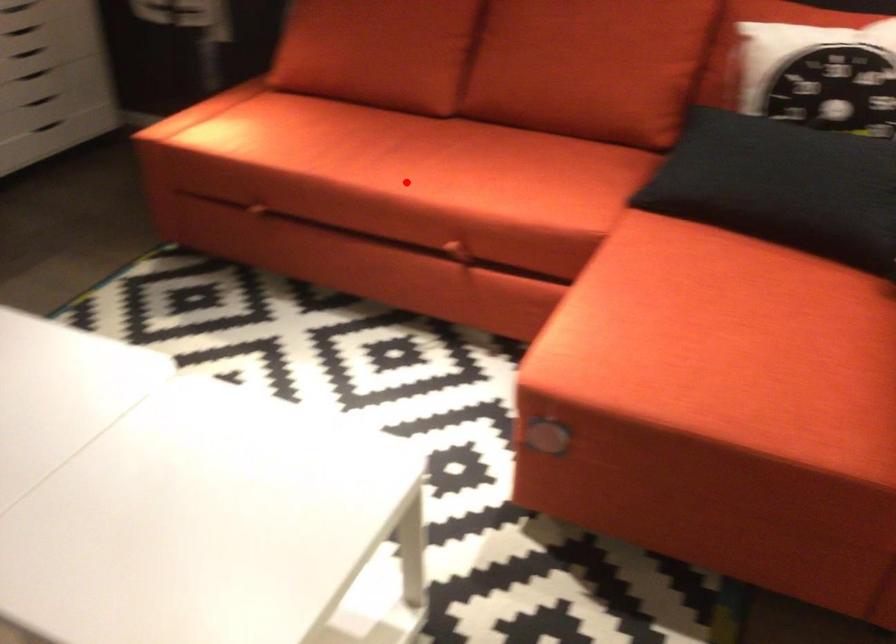
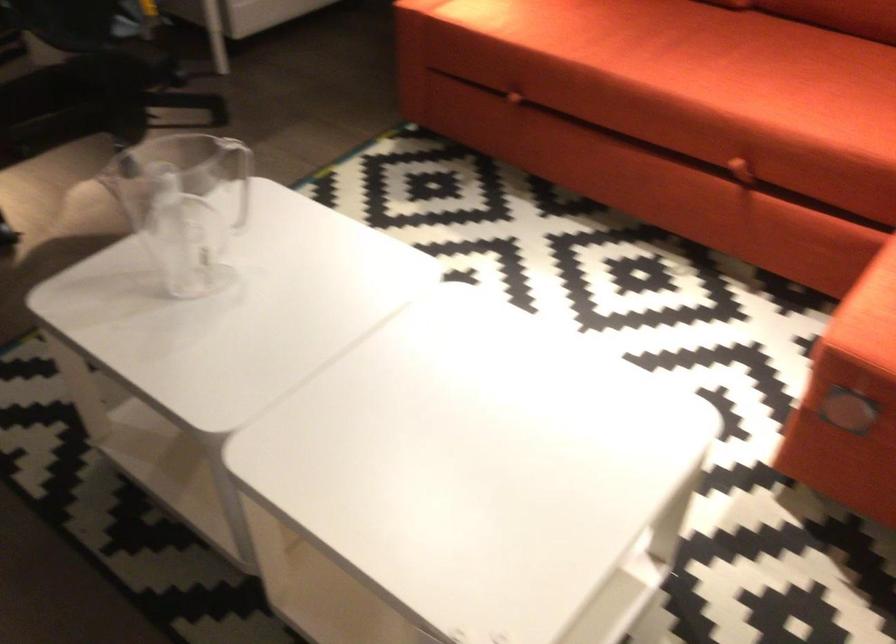
Question: I am providing you with two images of the same scene from different viewpoints. Given a red point in image1, look at the same physical point in image2. Is it:

Choices:
 (A) Closer to the viewpoint
 (B) Farther from the viewpoint

Answer: (A)